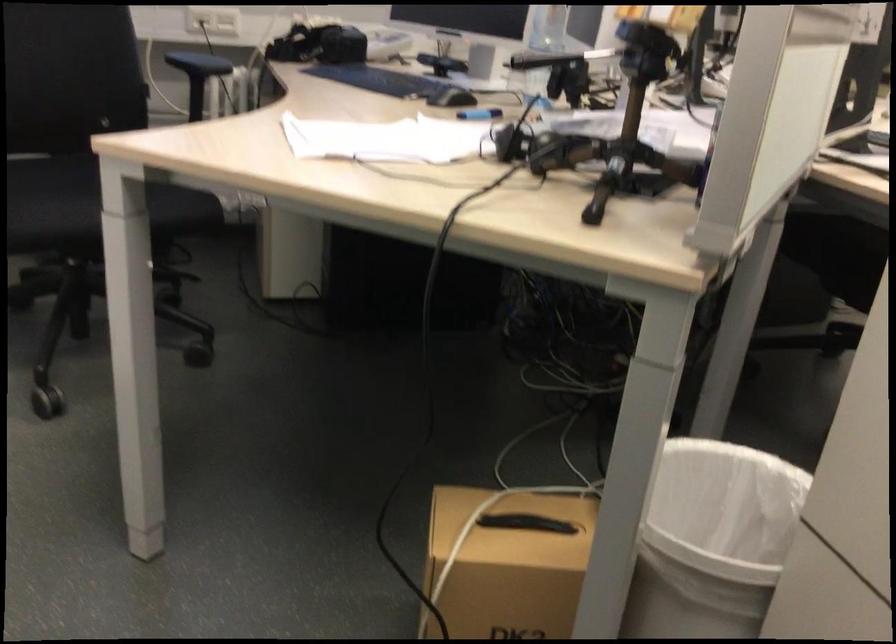
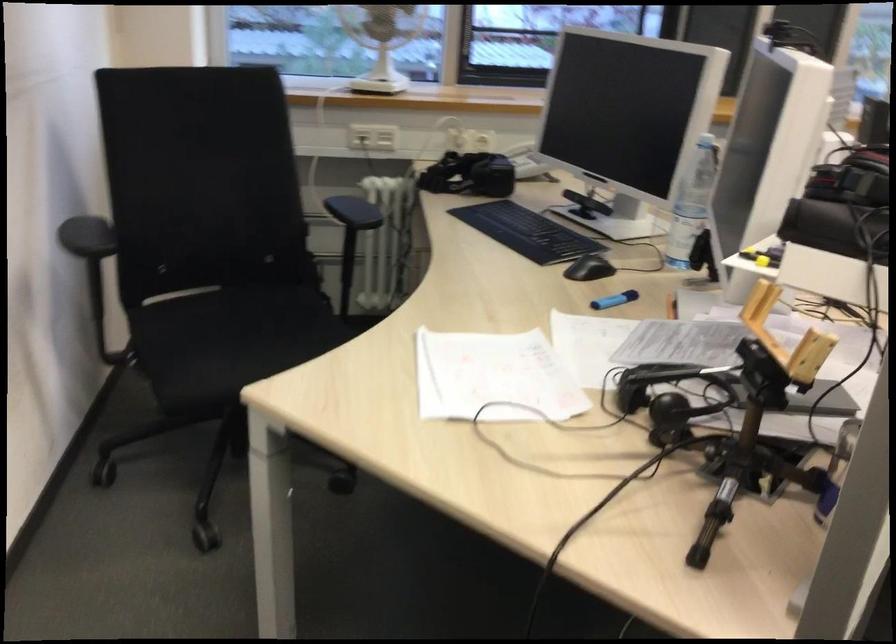
What movement of the cameraman would produce the second image?

The cameraman walked toward right, backward.